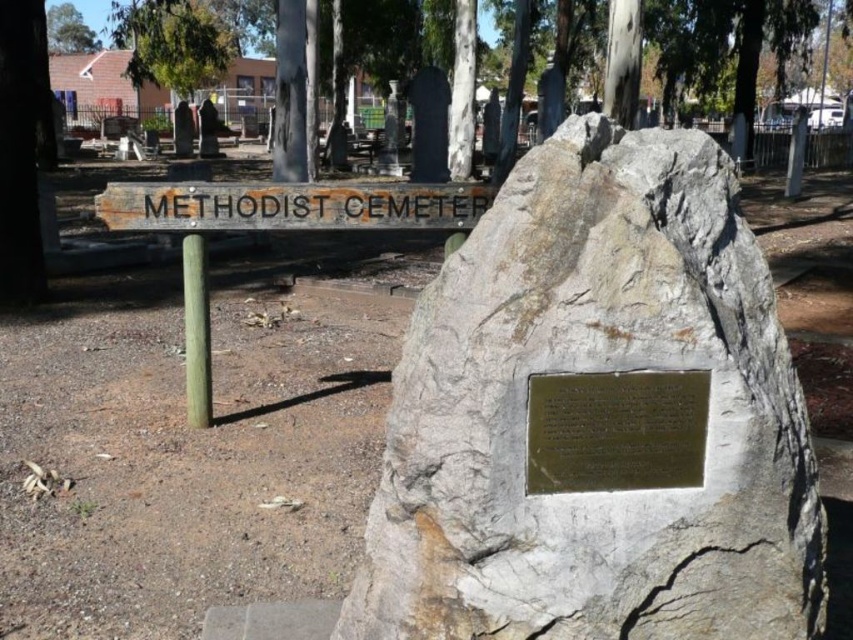
You are standing at the entrance of the Methodist Cemetery and want to locate the bronze plaque at center. According to the coordinates provided, where should you look to find it?

The bronze plaque at center is located at coordinates point (x=614, y=429).

You are a tour guide leading a group through the Methodist Cemetery. You want to point out both the gray stone boulder at center and the rusty wood sign at center to your visitors. Which object should you mention first if you want to start with the larger one?

The gray stone boulder at center is larger in size than the rusty wood sign at center, so you should mention the gray stone boulder at center first.

You are visiting the Methodist Cemetery and want to place a bouquet of flowers between the gray stone boulder at center and the green leafy tree at upper left. Based on their sizes, which object should you place the bouquet closer to?

The gray stone boulder at center is smaller than the green leafy tree at upper left, so you should place the bouquet closer to the gray stone boulder at center to ensure it is visible between them.